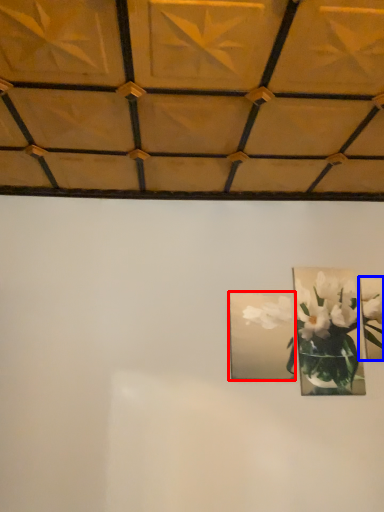
Question: Which point is further to the camera, picture frame (highlighted by a red box) or picture frame (highlighted by a blue box)?

Choices:
 (A) picture frame
 (B) picture frame

Answer: (B)